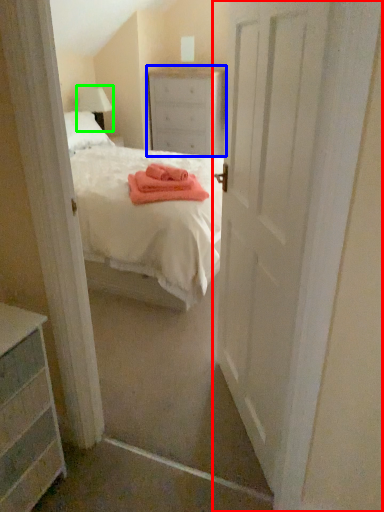
Question: Considering the real-world distances, which object is closest to door (highlighted by a red box)? nightstand (highlighted by a blue box) or lamp (highlighted by a green box).

Choices:
 (A) nightstand
 (B) lamp

Answer: (A)